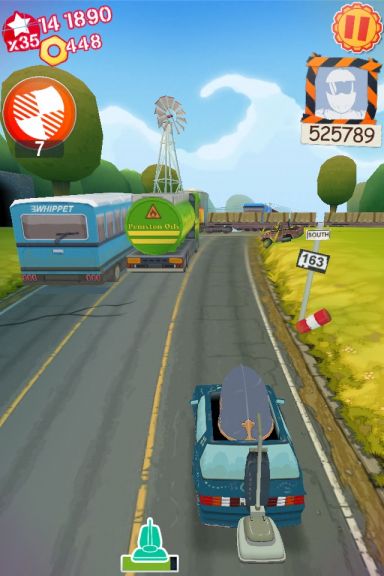
What are the coordinates of `vacuum` in the screenshot? It's located at (252, 529).